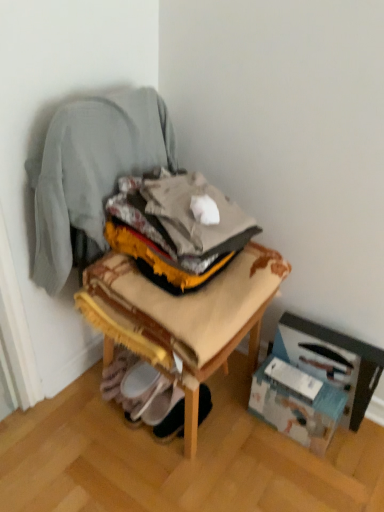
The height and width of the screenshot is (512, 384). In order to click on blank area to the left of white fabric shoe at lower center in this screenshot , I will do `click(121, 435)`.